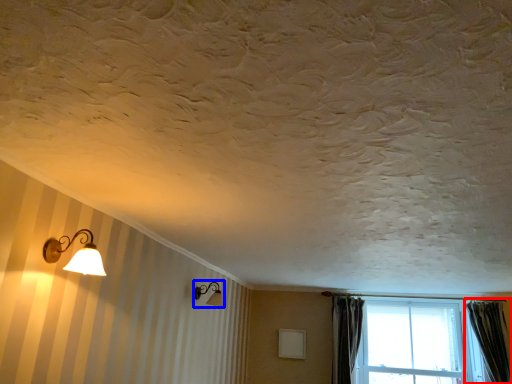
Question: Which object is further to the camera taking this photo, curtain (highlighted by a red box) or lamp (highlighted by a blue box)?

Choices:
 (A) curtain
 (B) lamp

Answer: (A)